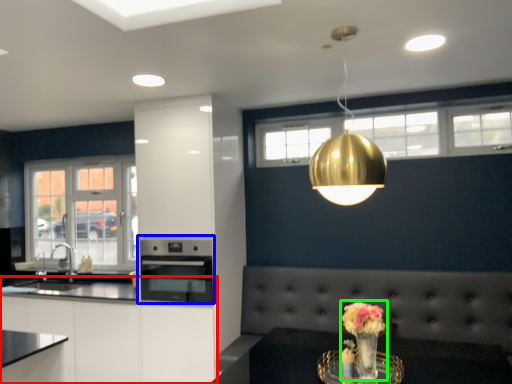
Question: Which object is the closest to the cabinetry (highlighted by a red box)? Choose among these: oven (highlighted by a blue box) or floral arrangement (highlighted by a green box).

Choices:
 (A) oven
 (B) floral arrangement

Answer: (A)